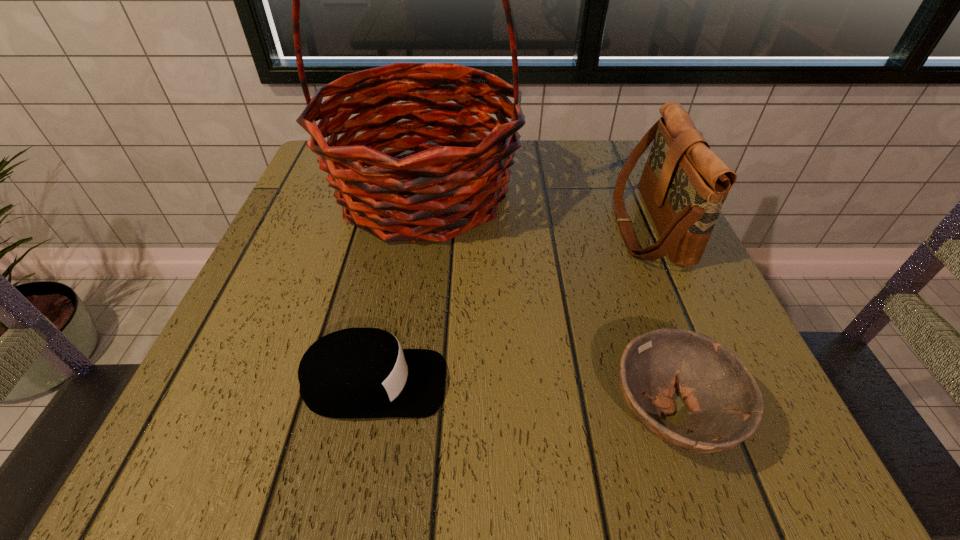
Locate an element on the screen. This screenshot has width=960, height=540. the tallest object is located at coordinates (460, 171).

This screenshot has height=540, width=960. In order to click on the second tallest object in this screenshot , I will do `click(684, 184)`.

Locate an element on the screen. This screenshot has height=540, width=960. cap is located at coordinates (354, 373).

Where is `bowl`? The image size is (960, 540). bowl is located at coordinates (725, 403).

At what (x,y) coordinates should I click in order to perform the action: click on free space located on the handle side of the tallest object. Please return your answer as a coordinate pair (x, y). Looking at the image, I should click on (410, 279).

This screenshot has width=960, height=540. What are the coordinates of `blank area located 0.380m on the front-facing side of the third shortest object` in the screenshot? It's located at pos(425,226).

The image size is (960, 540). In order to click on vacant area situated 0.070m on the front-facing side of the third shortest object in this screenshot , I will do `click(581, 226)`.

Find the location of a particular element. vacant space situated 0.130m on the front-facing side of the third shortest object is located at coordinates (551, 226).

This screenshot has height=540, width=960. What are the coordinates of `blank space located on the front-facing side of the cap` in the screenshot? It's located at (530, 383).

This screenshot has height=540, width=960. Identify the location of blank space located 0.270m on the left of the bowl. (408, 414).